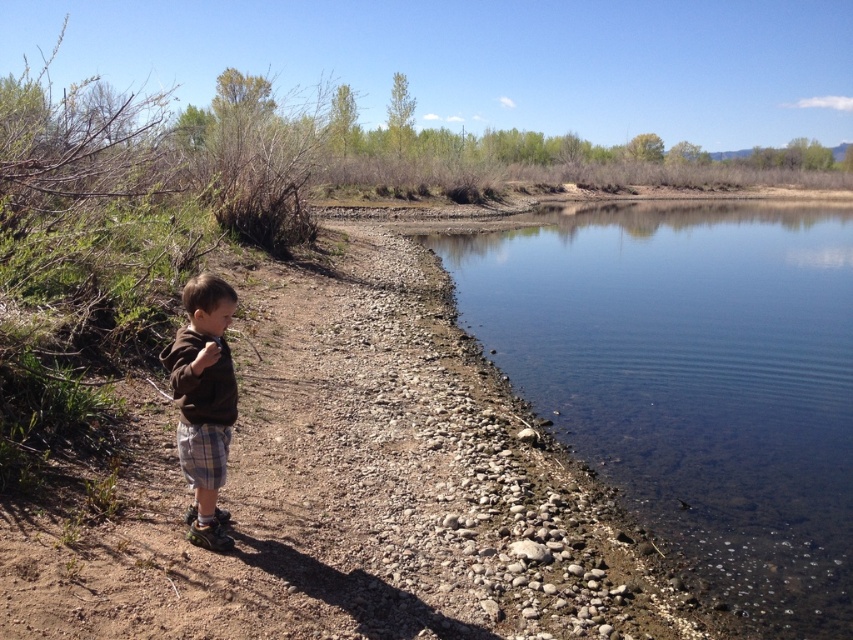
You are a hiker who wants to walk from the brown cotton shirt at left to the edge of the water. Given that the brown dirt path at center is the only clear path available, can you walk directly to the water without stepping off the path?

The brown dirt path at center has a larger size compared to brown cotton shirt at left, so yes, you can walk directly to the water without stepping off the path because the path is wide enough to accommodate your path from the shirt to the water edge.